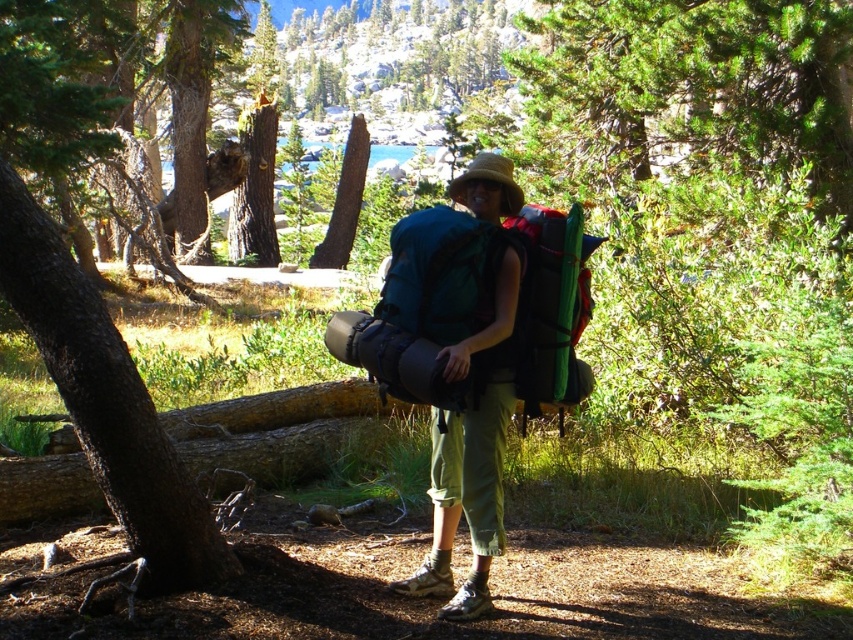
Is matte blue backpack at center further to camera compared to green fabric backpack at center?

That is False.

Who is positioned more to the left, matte blue backpack at center or green fabric backpack at center?

Positioned to the left is matte blue backpack at center.

Where is `matte blue backpack at center`? The height and width of the screenshot is (640, 853). matte blue backpack at center is located at coordinates (466, 500).

Where is `matte blue backpack at center`? The width and height of the screenshot is (853, 640). matte blue backpack at center is located at coordinates (466, 500).

Does dark brown bark at left have a greater width compared to matte green backpack at center?

Correct, the width of dark brown bark at left exceeds that of matte green backpack at center.

Is point (35, 241) farther from viewer compared to point (444, 285)?

No, it is in front of (444, 285).

Locate an element on the screen. This screenshot has height=640, width=853. dark brown bark at left is located at coordinates (86, 307).

Can you confirm if dark brown bark at left is positioned below green fabric backpack at center?

Actually, dark brown bark at left is above green fabric backpack at center.

Is point (149, 451) closer to camera compared to point (579, 232)?

That is True.

Between point (181, 502) and point (573, 384), which one is positioned in front?

Point (181, 502)

Identify the location of dark brown bark at left. The height and width of the screenshot is (640, 853). (86, 307).